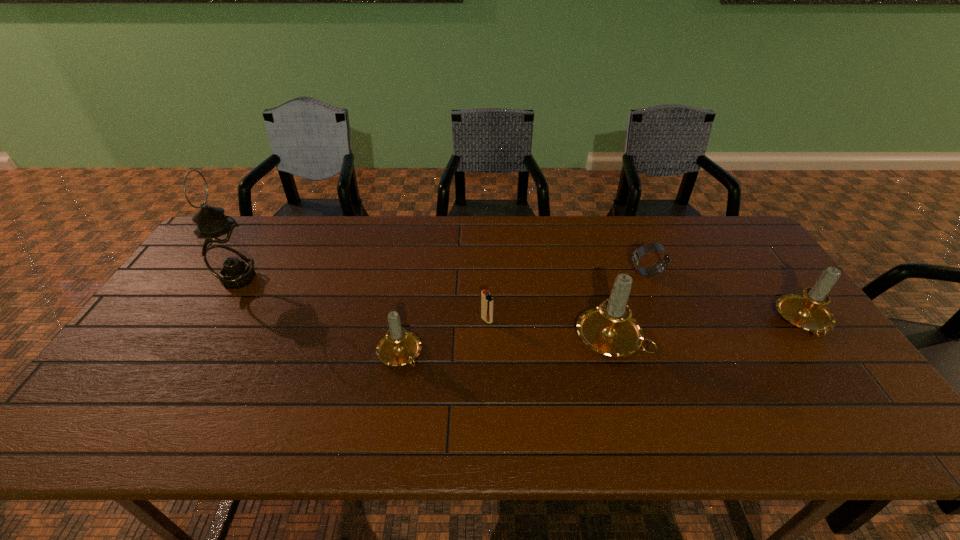
The width and height of the screenshot is (960, 540). I want to click on free location located 0.360m on the right of the fourth tallest object, so (x=562, y=354).

This screenshot has height=540, width=960. I want to click on vacant space located on the right of the second candle from left to right, so click(721, 338).

What are the coordinates of `vacant area located 0.350m on the back of the second tallest candle` in the screenshot? It's located at (736, 229).

At what (x,y) coordinates should I click in order to perform the action: click on free region located 0.170m on the front of the tallest object. Please return your answer as a coordinate pair (x, y). This screenshot has height=540, width=960. Looking at the image, I should click on (203, 338).

Where is `vacant space located on the left of the igniter`? vacant space located on the left of the igniter is located at coordinates (456, 320).

Where is `free space located on the face of the second object from right to left`? The height and width of the screenshot is (540, 960). free space located on the face of the second object from right to left is located at coordinates (504, 273).

Locate an element on the screen. The height and width of the screenshot is (540, 960). blank space located 0.400m on the face of the second object from right to left is located at coordinates (501, 273).

Where is `free point located 0.230m on the face of the second object from right to left`? The height and width of the screenshot is (540, 960). free point located 0.230m on the face of the second object from right to left is located at coordinates (556, 273).

At what (x,y) coordinates should I click in order to perform the action: click on object that is positioned at the near edge. Please return your answer as a coordinate pair (x, y). The height and width of the screenshot is (540, 960). Looking at the image, I should click on 398,347.

Identify the location of object located in the left edge section of the desktop. (224, 251).